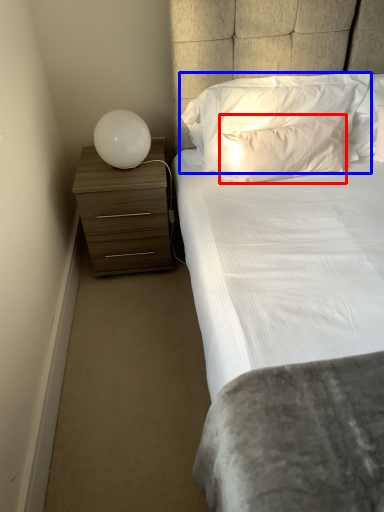
Question: Which object appears closest to the camera in this image, pillow (highlighted by a red box) or pillow (highlighted by a blue box)?

Choices:
 (A) pillow
 (B) pillow

Answer: (A)